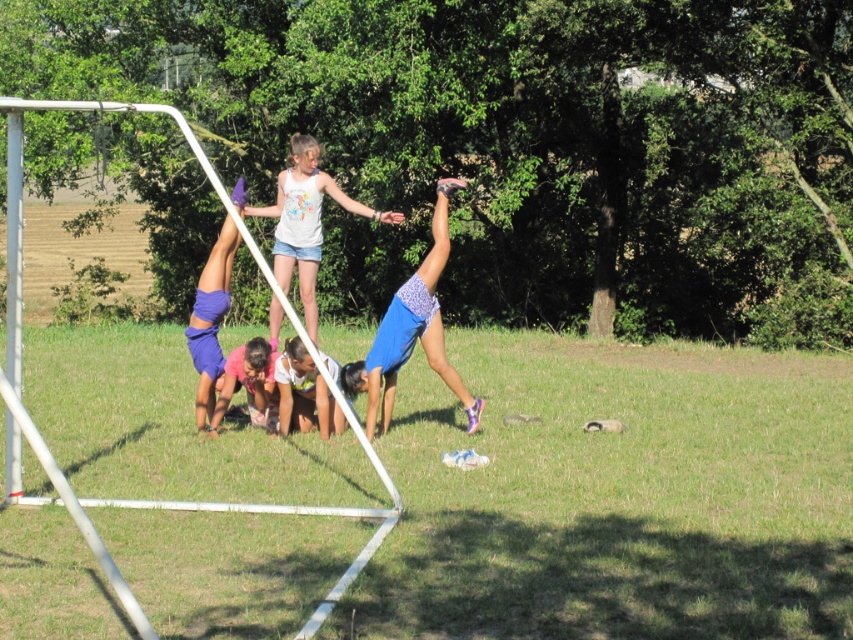
Does blue fabric shorts at center appear over purple fabric shorts at left?

No.

Who is higher up, blue fabric shorts at center or purple fabric shorts at left?

purple fabric shorts at left is higher up.

Which is behind, point (444, 340) or point (213, 256)?

Point (444, 340)

Find the location of a particular element. The image size is (853, 640). blue fabric shorts at center is located at coordinates (410, 330).

Between white cotton tank top at upper center and pink fabric at lower center, which one appears on the left side from the viewer's perspective?

pink fabric at lower center

Does white cotton tank top at upper center appear on the left side of pink fabric at lower center?

In fact, white cotton tank top at upper center is to the right of pink fabric at lower center.

Locate an element on the screen. white cotton tank top at upper center is located at coordinates (306, 220).

Which is in front, point (300, 147) or point (218, 266)?

Point (218, 266) is in front.

Image resolution: width=853 pixels, height=640 pixels. Describe the element at coordinates (306, 220) in the screenshot. I see `white cotton tank top at upper center` at that location.

Identify the location of white cotton tank top at upper center. (306, 220).